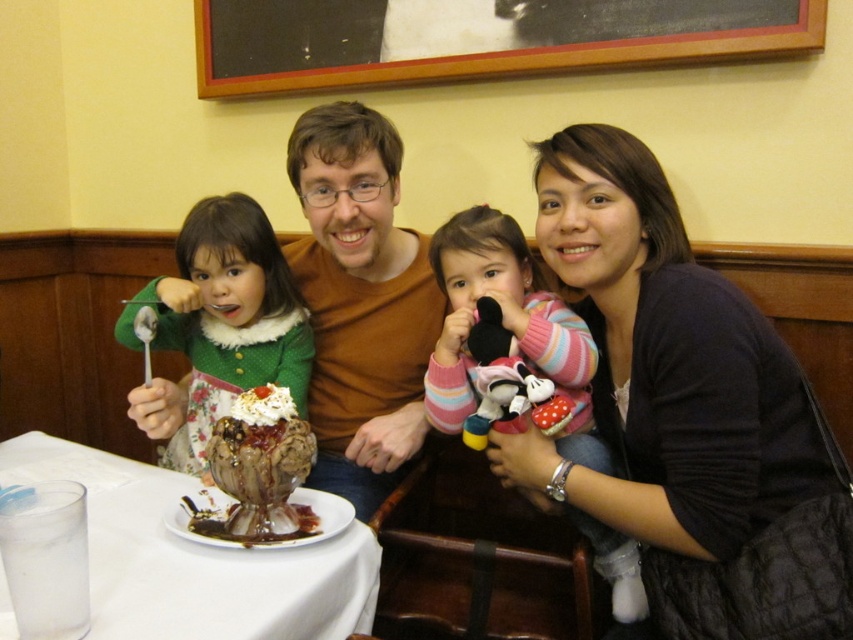
Question: Which point appears closest to the camera in this image?

Choices:
 (A) (500, 348)
 (B) (465, 316)
 (C) (302, 476)

Answer: (C)

Question: Which object appears closest to the camera in this image?

Choices:
 (A) chocolate fudge sundae at center
 (B) pink striped sweater at center
 (C) clear glass at lower left

Answer: (C)

Question: Can you confirm if green fuzzy sweater at left is positioned above chocolate fudge sundae at center?

Choices:
 (A) yes
 (B) no

Answer: (A)

Question: Which of the following is the farthest from the observer?

Choices:
 (A) green fuzzy sweater at left
 (B) chocolate fudge sundae at center

Answer: (A)

Question: Does green fuzzy sweater at left have a larger size compared to chocolate fudge sundae at center?

Choices:
 (A) yes
 (B) no

Answer: (A)

Question: Does matte brown sweater at center have a smaller size compared to clear glass at lower left?

Choices:
 (A) no
 (B) yes

Answer: (A)